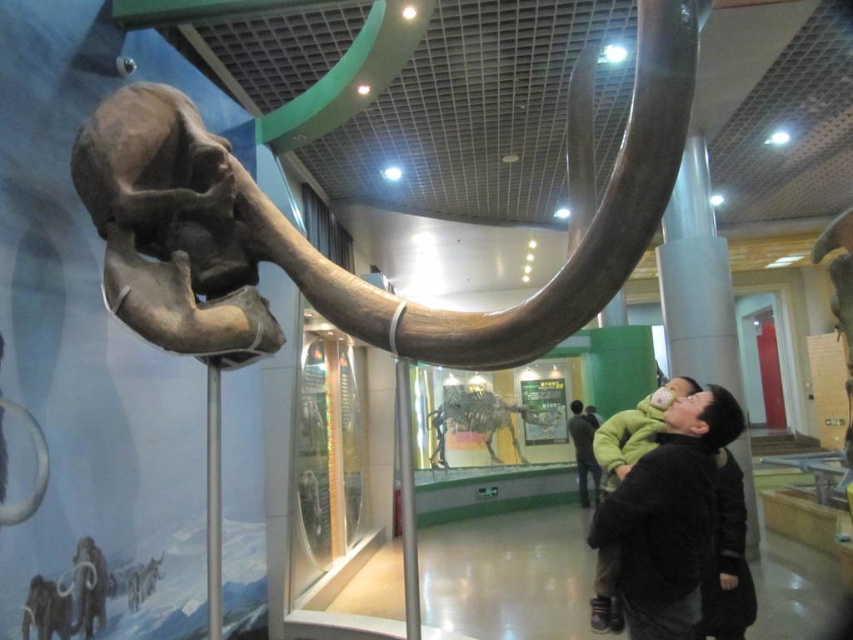
You are a visitor at the museum and want to take a photo of the polished gray elephant tusk at upper left and the black fuzzy coat at lower right. Which object should you focus on first to ensure both are in the frame?

You should focus on the polished gray elephant tusk at upper left first since it is closer to the viewer than the black fuzzy coat at lower right, ensuring both are in the frame by adjusting the camera angle accordingly.

You are a museum visitor standing in front of the mammoth exhibit. You notice the polished gray elephant tusk at upper left and the black fuzzy coat at lower right. Which object is taller?

The polished gray elephant tusk at upper left is shorter than the black fuzzy coat at lower right, so the black fuzzy coat at lower right is taller.

You are a visitor in the museum standing at the entrance of the mammoth exhibit. You notice two points marked on the floor at coordinates point (625, 480) and point (570, 426). Which point is closer to you as you face the mammoth skull display?

Point (625, 480) is in front of point (570, 426), so it is closer to you as you face the mammoth skull display.